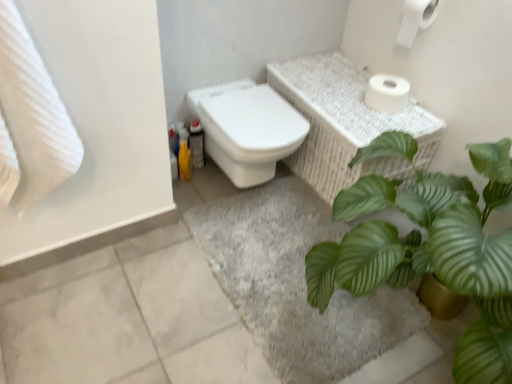
Question: Is gray soft rug at lower center looking in the opposite direction of white textured towel at left?

Choices:
 (A) no
 (B) yes

Answer: (A)

Question: Is gray soft rug at lower center behind white textured towel at left?

Choices:
 (A) yes
 (B) no

Answer: (A)

Question: From the image's perspective, is gray soft rug at lower center beneath white textured towel at left?

Choices:
 (A) no
 (B) yes

Answer: (B)

Question: Can you confirm if gray soft rug at lower center is smaller than white textured towel at left?

Choices:
 (A) no
 (B) yes

Answer: (B)

Question: Is gray soft rug at lower center bigger than white textured towel at left?

Choices:
 (A) yes
 (B) no

Answer: (B)

Question: From their relative heights in the image, would you say white matte toilet paper at upper right, the second toilet paper ordered from the bottom, is taller or shorter than white matte toilet paper at upper right, which is counted as the 1th toilet paper, starting from the bottom?

Choices:
 (A) tall
 (B) short

Answer: (A)

Question: From the image's perspective, is white matte toilet paper at upper right, the second toilet paper ordered from the bottom, located above or below white matte toilet paper at upper right, which is counted as the 1th toilet paper, starting from the bottom?

Choices:
 (A) above
 (B) below

Answer: (A)

Question: Is point (421, 18) positioned closer to the camera than point (376, 96)?

Choices:
 (A) closer
 (B) farther

Answer: (A)

Question: Considering the positions of white matte toilet paper at upper right, which is the 1th toilet paper from top to bottom, and white matte toilet paper at upper right, which is counted as the 1th toilet paper, starting from the bottom, in the image, is white matte toilet paper at upper right, which is the 1th toilet paper from top to bottom, bigger or smaller than white matte toilet paper at upper right, which is counted as the 1th toilet paper, starting from the bottom,?

Choices:
 (A) big
 (B) small

Answer: (B)

Question: From the image's perspective, is gray soft rug at lower center above or below white glossy toilet at center?

Choices:
 (A) above
 (B) below

Answer: (B)

Question: Looking at their shapes, would you say gray soft rug at lower center is wider or thinner than white glossy toilet at center?

Choices:
 (A) thin
 (B) wide

Answer: (B)

Question: Based on their positions, is gray soft rug at lower center located to the left or right of white glossy toilet at center?

Choices:
 (A) left
 (B) right

Answer: (B)

Question: Considering the positions of gray soft rug at lower center and white glossy toilet at center in the image, is gray soft rug at lower center bigger or smaller than white glossy toilet at center?

Choices:
 (A) small
 (B) big

Answer: (A)

Question: From their relative heights in the image, would you say gray soft rug at lower center is taller or shorter than white matte toilet paper at upper right, which is counted as the 1th toilet paper, starting from the bottom?

Choices:
 (A) tall
 (B) short

Answer: (B)

Question: Is gray soft rug at lower center spatially inside white matte toilet paper at upper right, which is counted as the 1th toilet paper, starting from the bottom, or outside of it?

Choices:
 (A) inside
 (B) outside

Answer: (B)